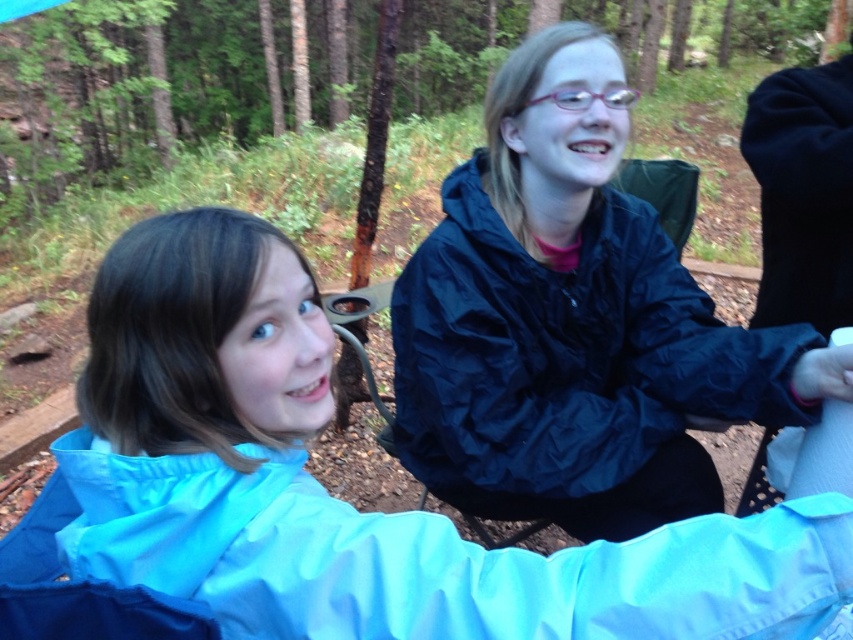
Question: Is blue waterproof jacket at upper left above matte black jacket at center?

Choices:
 (A) no
 (B) yes

Answer: (A)

Question: Is blue waterproof jacket at upper left to the right of matte black jacket at center from the viewer's perspective?

Choices:
 (A) yes
 (B) no

Answer: (B)

Question: Which point appears farthest from the camera in this image?

Choices:
 (A) (106, 285)
 (B) (636, 432)

Answer: (B)

Question: Is blue waterproof jacket at upper left smaller than matte black jacket at center?

Choices:
 (A) yes
 (B) no

Answer: (A)

Question: Which point is closer to the camera taking this photo?

Choices:
 (A) (566, 472)
 (B) (519, 621)

Answer: (B)